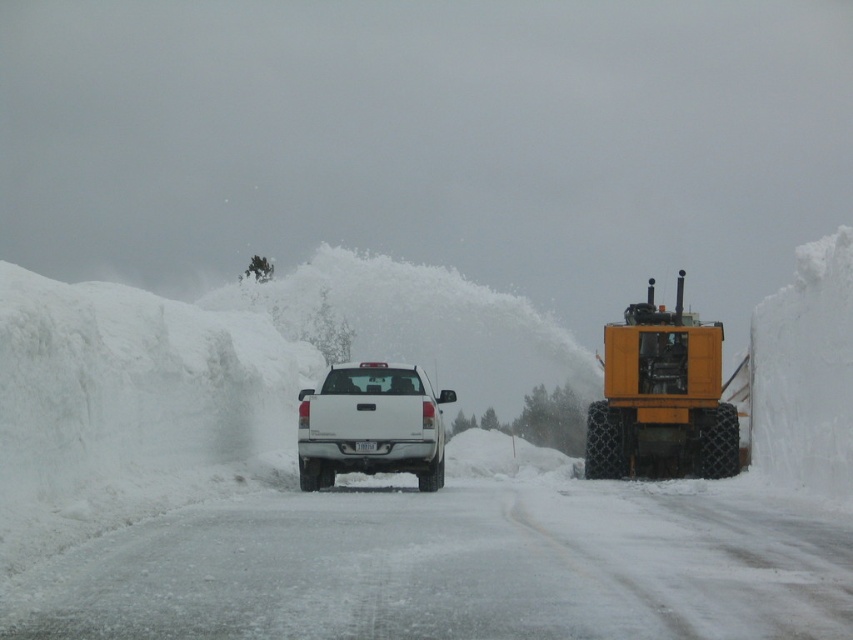
Does white fluffy snow at center appear on the right side of yellow rubber tractor at right?

Incorrect, white fluffy snow at center is not on the right side of yellow rubber tractor at right.

What do you see at coordinates (390, 492) in the screenshot? I see `white fluffy snow at center` at bounding box center [390, 492].

What do you see at coordinates (390, 492) in the screenshot? I see `white fluffy snow at center` at bounding box center [390, 492].

This screenshot has width=853, height=640. In order to click on white fluffy snow at center in this screenshot , I will do `click(390, 492)`.

Is point (616, 436) less distant than point (370, 374)?

No, (616, 436) is behind (370, 374).

Who is lower down, yellow rubber tractor at right or white matte truck at center?

white matte truck at center is below.

Who is more forward, (651,289) or (320,403)?

Positioned in front is point (320,403).

This screenshot has width=853, height=640. I want to click on yellow rubber tractor at right, so (660, 397).

Which is in front, point (134, 625) or point (425, 428)?

Point (134, 625)

Where is `white fluffy snow at center`? Image resolution: width=853 pixels, height=640 pixels. white fluffy snow at center is located at coordinates (390, 492).

Does point (451, 346) come in front of point (367, 424)?

No, (451, 346) is behind (367, 424).

The height and width of the screenshot is (640, 853). What are the coordinates of `white fluffy snow at center` in the screenshot? It's located at (390, 492).